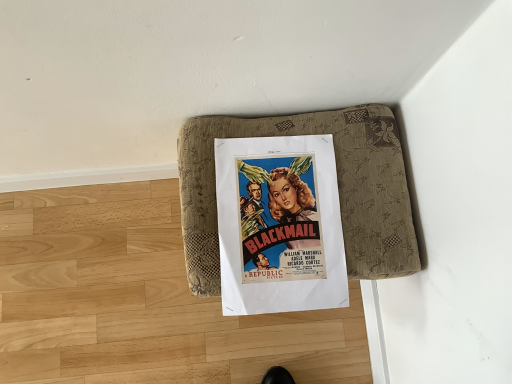
Where is `free space on the front side of vibrant paper poster at center`? This screenshot has height=384, width=512. free space on the front side of vibrant paper poster at center is located at coordinates (241, 344).